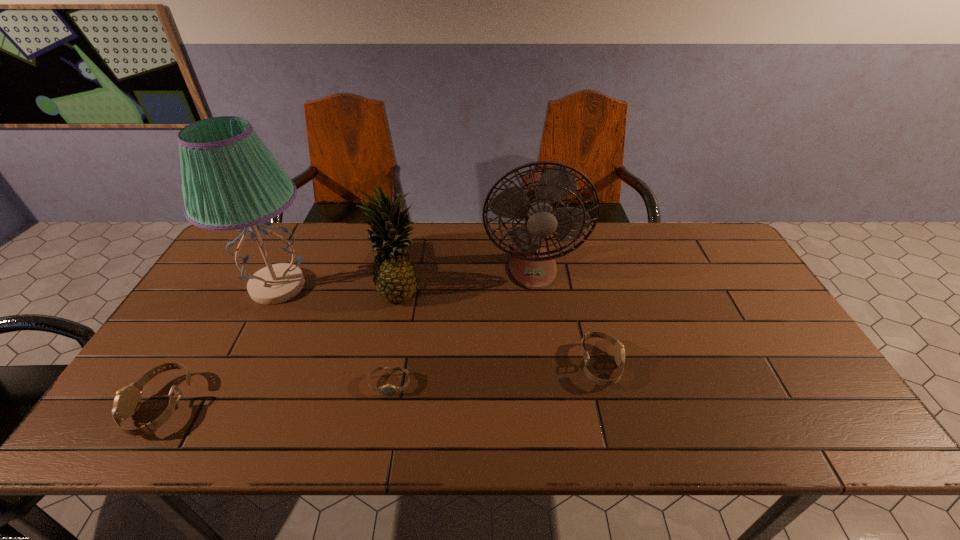
Please point a spot on the right to add another watch. Please provide its 2D coordinates. Your answer should be formatted as a tuple, i.e. [(x, y)], where the tuple contains the x and y coordinates of a point satisfying the conditions above.

[(795, 347)]